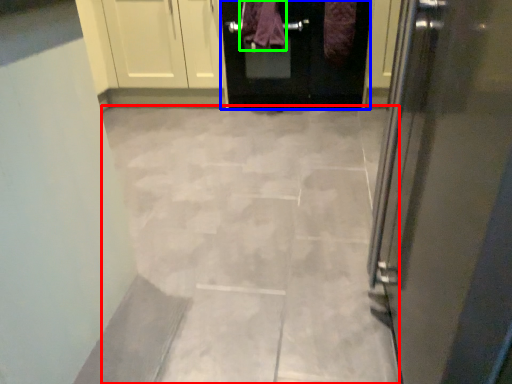
Question: Considering the real-world distances, which object is farthest from ceramic tile (highlighted by a red box)? door (highlighted by a blue box) or blanket (highlighted by a green box)?

Choices:
 (A) door
 (B) blanket

Answer: (B)